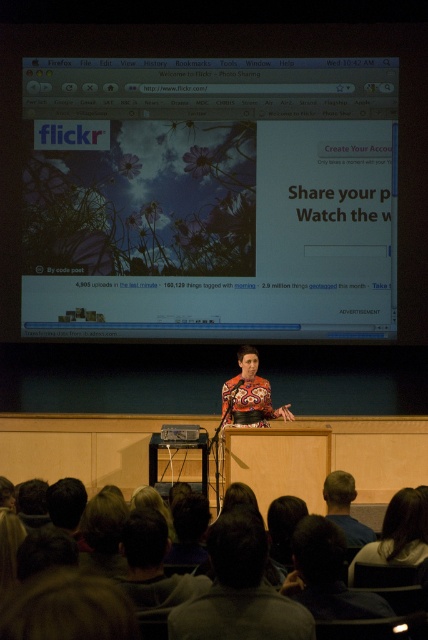
You are an attendee at the presentation and want to determine which of the two points, point (151, 244) or point (183, 426), is closer to you. Based on the scene description, which point is nearer?

Point (151, 244) is further to the viewer than point (183, 426). Wait, that contradicts the question. Let me check again. The Objects Description says point (151, 244) is further to the viewer than point (183, 426). So the closer point would be the one that is less further, which is point (183, 426). Therefore, the answer should state that point (183, 426) is closer to the viewer.

You are a photographer in the audience at a presentation. You want to take a photo of the speaker and ensure both the dark gray hair at lower center and the dark brown hair at lower right are visible in the frame. Which hair style should you focus on to include both in the shot?

The dark gray hair at lower center is taller than the dark brown hair at lower right, so focusing on the dark gray hair at lower center will ensure both are visible in the frame.